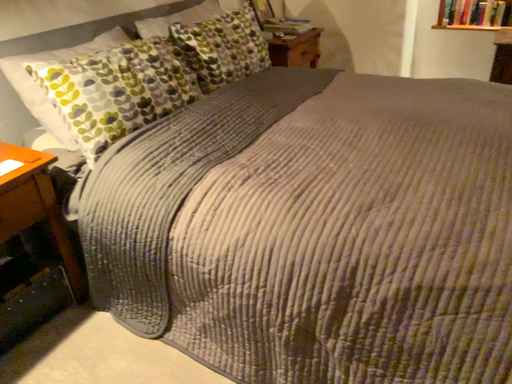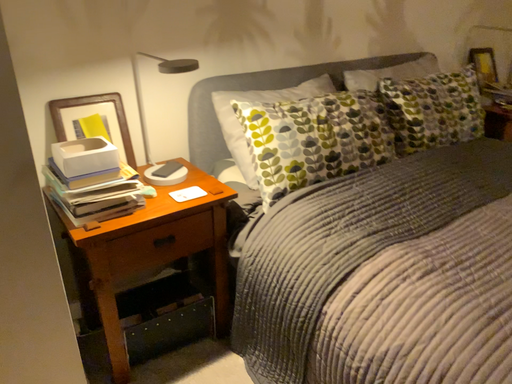
Question: Which way did the camera rotate in the video?

Choices:
 (A) rotated downward
 (B) rotated upward

Answer: (B)